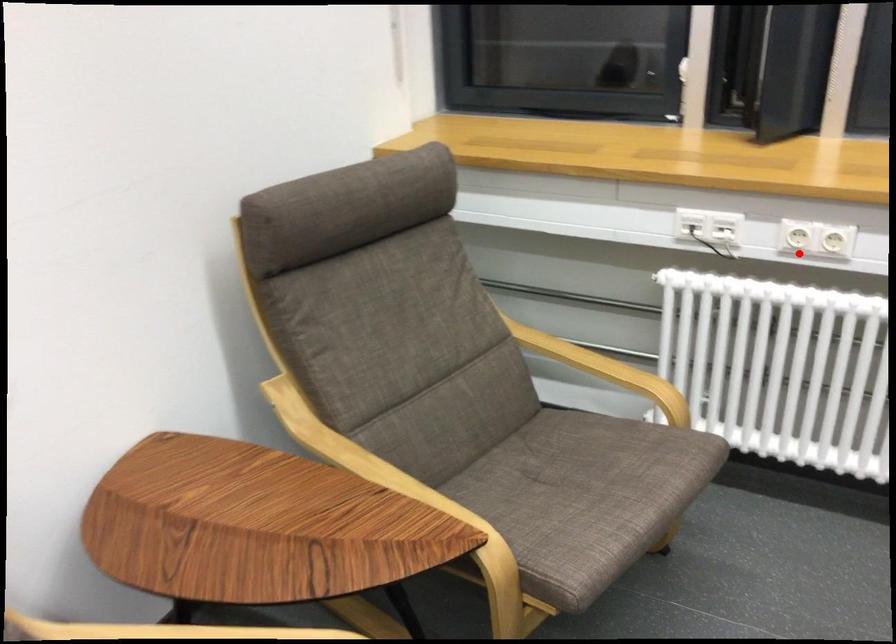
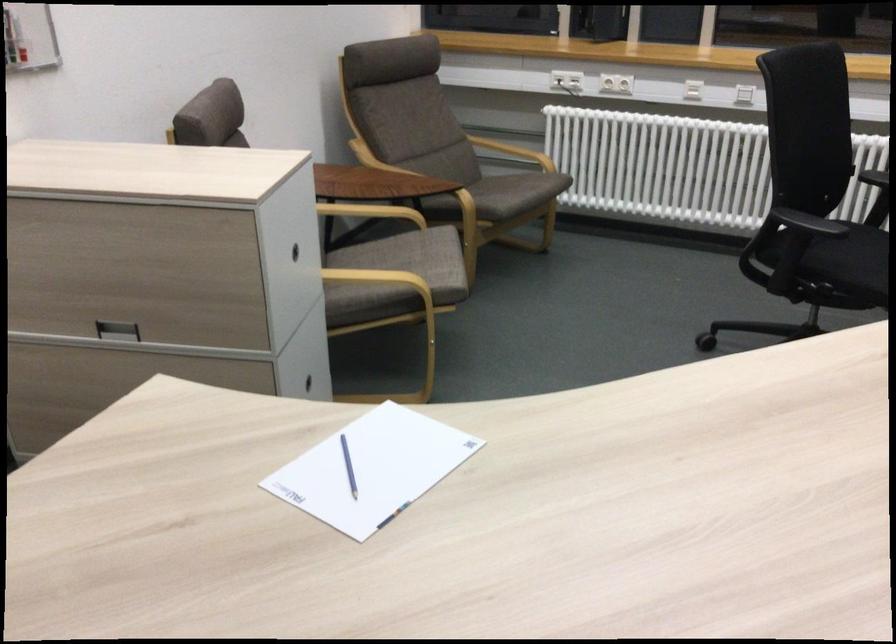
Question: I am providing you with two images of the same scene from different viewpoints. Given a red point in image1, look at the same physical point in image2. Is it:

Choices:
 (A) Closer to the viewpoint
 (B) Farther from the viewpoint

Answer: (B)